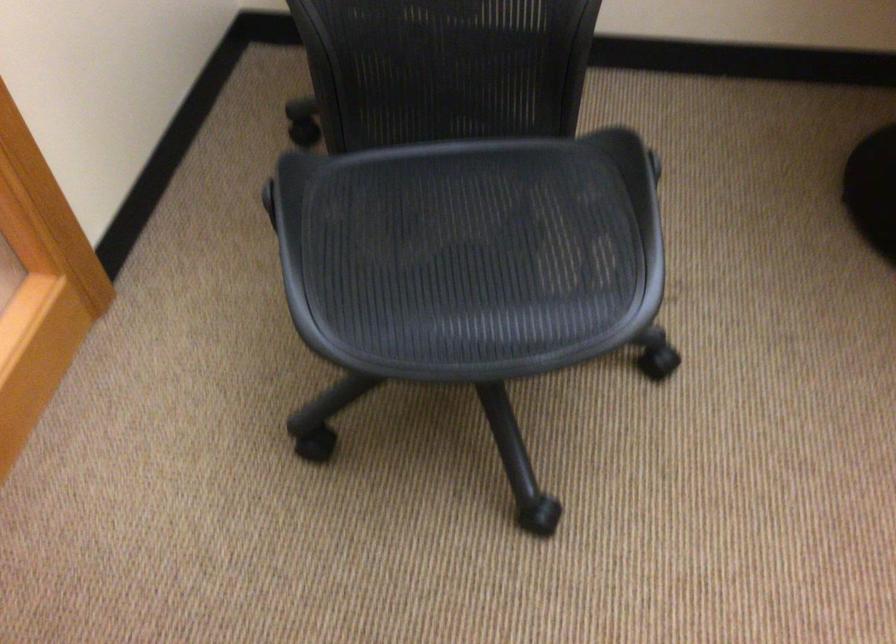
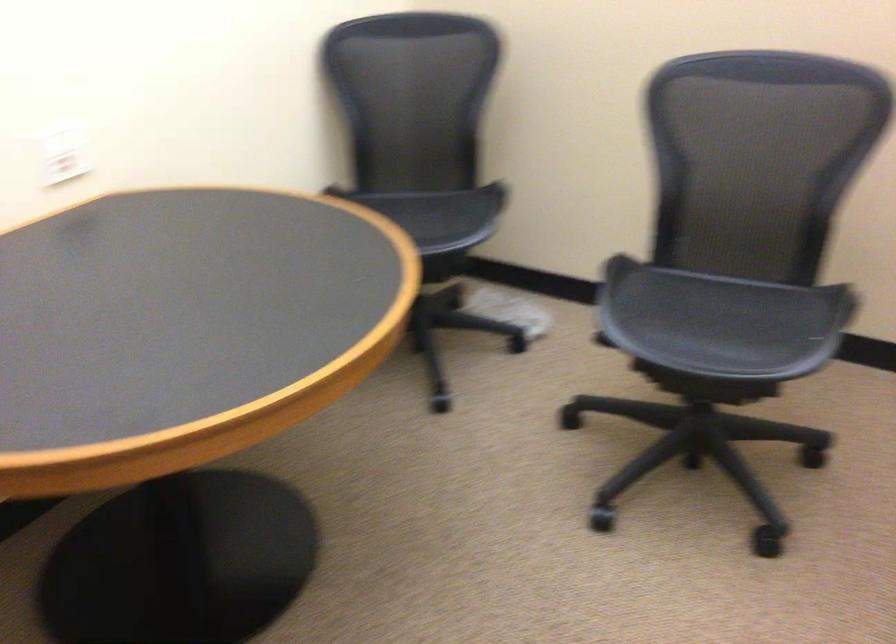
Question: The camera is either moving clockwise (left) or counter-clockwise (right) around the object. The first image is from the beginning of the video and the second image is from the end. Is the camera moving left or right when shooting the video?

Choices:
 (A) Left
 (B) Right

Answer: (A)